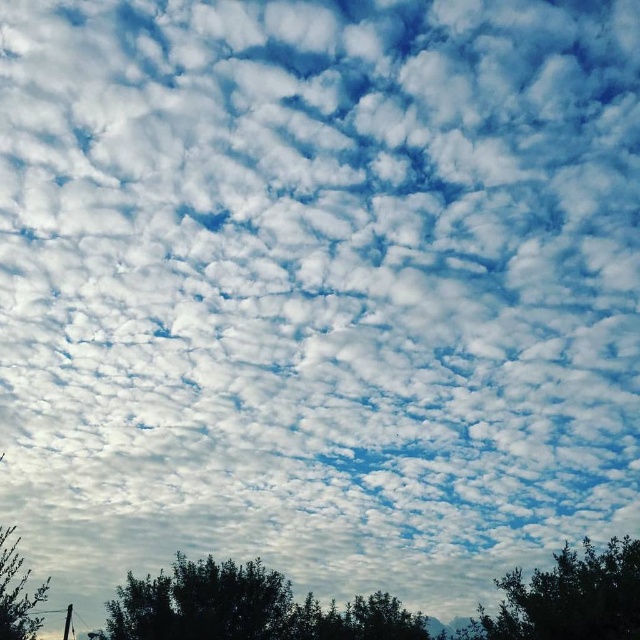
Does point (500, 580) come behind point (3, 589)?

Yes, it is.

You are a GUI agent. You are given a task and a screenshot of the screen. Output one action in this format:
    pyautogui.click(x=<x>, y=<y>)
    Task: Click on the green leafy tree at lower right
    The height and width of the screenshot is (640, 640).
    Given the screenshot: What is the action you would take?
    coord(572,596)

Find the location of a particular element. Image resolution: width=640 pixels, height=640 pixels. green leafy tree at lower center is located at coordinates (244, 608).

Can you confirm if green leafy tree at lower center is positioned to the right of green leafy tree at lower left?

Correct, you'll find green leafy tree at lower center to the right of green leafy tree at lower left.

Is point (289, 620) positioned behind point (33, 632)?

That is True.

Identify the location of green leafy tree at lower center. [x=244, y=608].

Which is above, green leafy tree at lower center or green leafy tree at lower right?

green leafy tree at lower right

The image size is (640, 640). What are the coordinates of `green leafy tree at lower center` in the screenshot? It's located at (244, 608).

You are a GUI agent. You are given a task and a screenshot of the screen. Output one action in this format:
    pyautogui.click(x=<x>, y=<y>)
    Task: Click on the green leafy tree at lower center
    
    Given the screenshot: What is the action you would take?
    pyautogui.click(x=244, y=608)